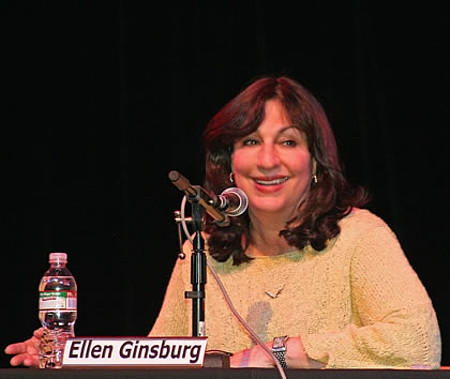
Locate an element on the screen. mic is located at coordinates (242, 196), (222, 201).